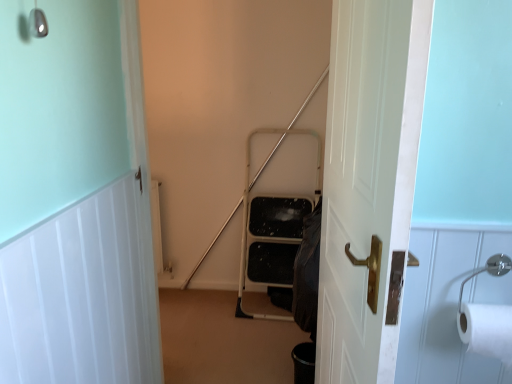
Question: Would you say white wood door at upper left, the 2th door when ordered from right to left, is inside or outside white paper at right?

Choices:
 (A) outside
 (B) inside

Answer: (A)

Question: Is point (136, 319) positioned closer to the camera than point (501, 337)?

Choices:
 (A) closer
 (B) farther

Answer: (B)

Question: Estimate the real-world distances between objects in this image. Which object is closer to the white paper at right?

Choices:
 (A) white wooden door at center, marked as the first door in a right-to-left arrangement
 (B) white wood door at upper left, which is the first door from left to right

Answer: (A)

Question: Based on their relative distances, which object is farther from the white wooden door at center, marked as the first door in a right-to-left arrangement?

Choices:
 (A) white paper at right
 (B) white wood door at upper left, which is the first door from left to right

Answer: (B)